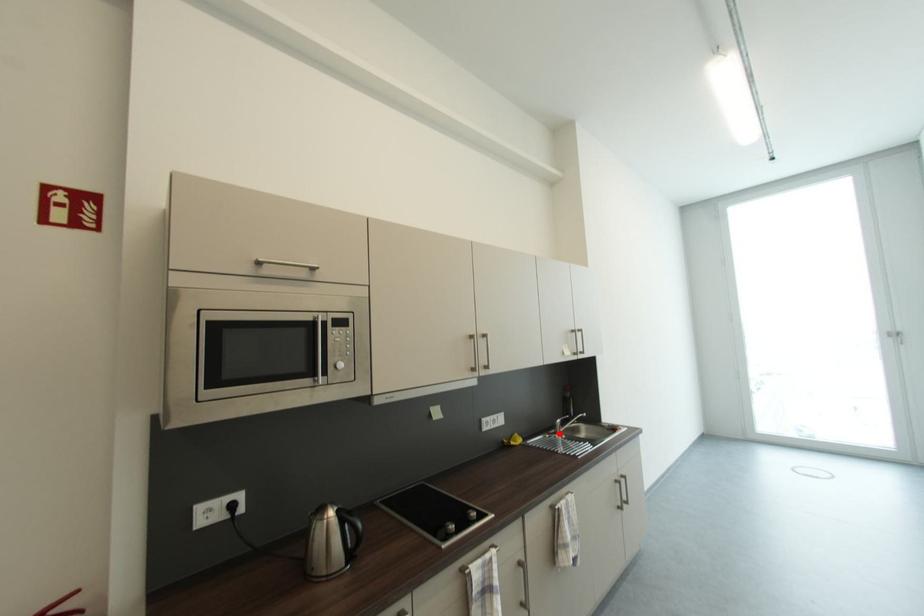
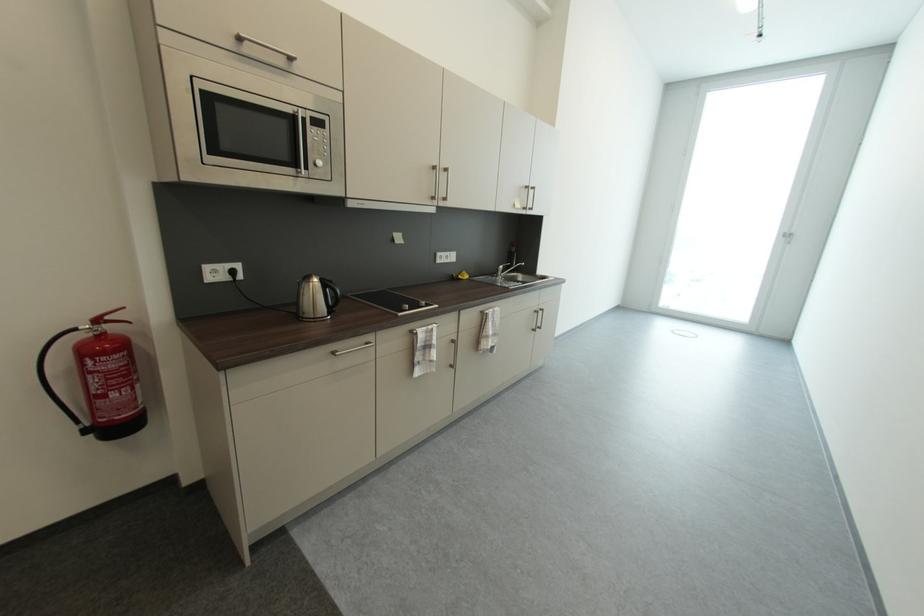
Question: I am providing you with two images of the same scene from different viewpoints. A red point is marked on the first image. At the location where the point appears in image 1, is it still visible in image 2?

Choices:
 (A) Yes
 (B) No

Answer: (A)